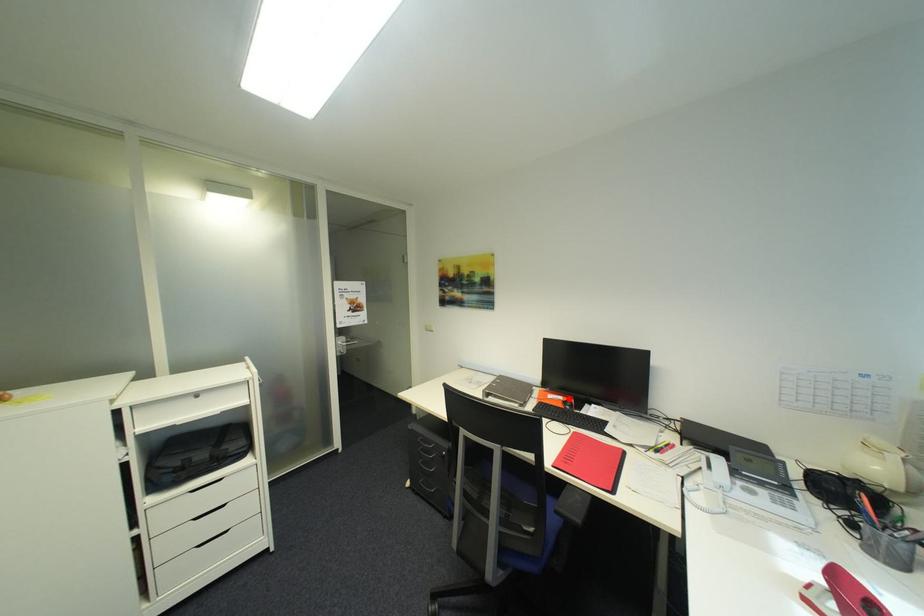
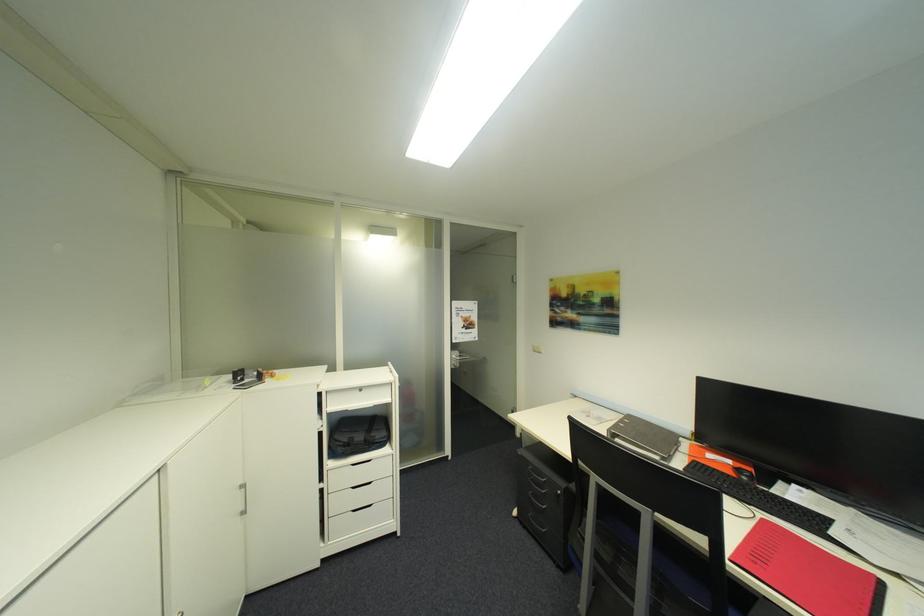
Question: I am providing you with two images of the same scene from different viewpoints. A red point is shown in image1. For the corresponding object point in image2, is it positioned nearer or farther from the camera?

Choices:
 (A) Nearer
 (B) Farther

Answer: (A)